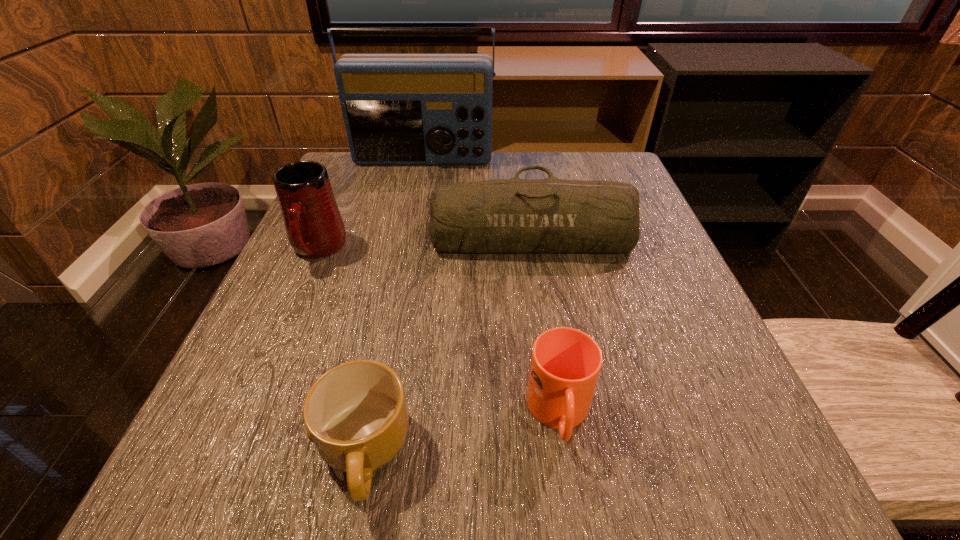
Where is `free space at the left edge of the desktop`? free space at the left edge of the desktop is located at coordinates (276, 288).

Image resolution: width=960 pixels, height=540 pixels. In order to click on vacant area at the right edge in this screenshot , I will do `click(677, 357)`.

In order to click on free space at the far right corner of the desktop in this screenshot , I will do `click(576, 167)`.

This screenshot has height=540, width=960. What are the coordinates of `vacant space at the near right corner` in the screenshot? It's located at (754, 450).

The image size is (960, 540). In order to click on empty location between the second tallest mug and the shortest object in this screenshot , I will do `click(462, 433)`.

Locate an element on the screen. free space between the second tallest object and the second mug from left to right is located at coordinates (341, 351).

Find the location of a particular element. The height and width of the screenshot is (540, 960). free space that is in between the radio receiver and the second mug from right to left is located at coordinates (394, 306).

Where is `empty space between the farthest object and the shortest mug`? This screenshot has width=960, height=540. empty space between the farthest object and the shortest mug is located at coordinates (394, 306).

This screenshot has width=960, height=540. I want to click on vacant area between the second mug from right to left and the rightmost mug, so click(x=462, y=433).

Locate an element on the screen. unoccupied area between the shortest mug and the radio receiver is located at coordinates (394, 306).